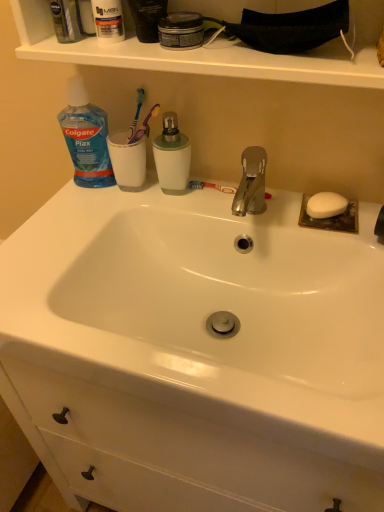
The width and height of the screenshot is (384, 512). I want to click on free spot to the right of green matte mouthwash at center, the first mouthwash in the bottom-to-top sequence, so click(x=239, y=201).